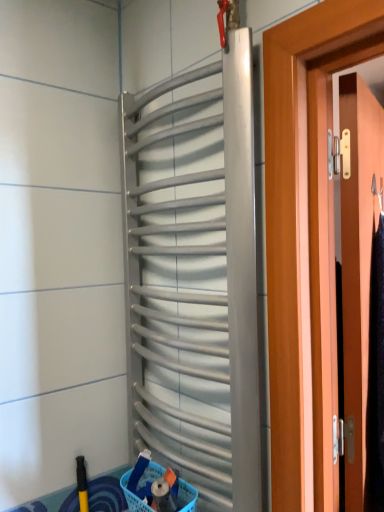
Question: In the image, is silver metallic radiator at center positioned in front of or behind blue plastic basket at lower center?

Choices:
 (A) front
 (B) behind

Answer: (A)

Question: From their relative heights in the image, would you say silver metallic radiator at center is taller or shorter than blue plastic basket at lower center?

Choices:
 (A) short
 (B) tall

Answer: (B)

Question: Considering the real-world distances, which object is farthest from the wooden door at right?

Choices:
 (A) blue plastic basket at lower center
 (B) silver metallic radiator at center
 (C) yellow rubber brush at lower left

Answer: (C)

Question: Considering the real-world distances, which object is farthest from the wooden door at right?

Choices:
 (A) yellow rubber brush at lower left
 (B) silver metallic radiator at center
 (C) blue plastic basket at lower center

Answer: (A)